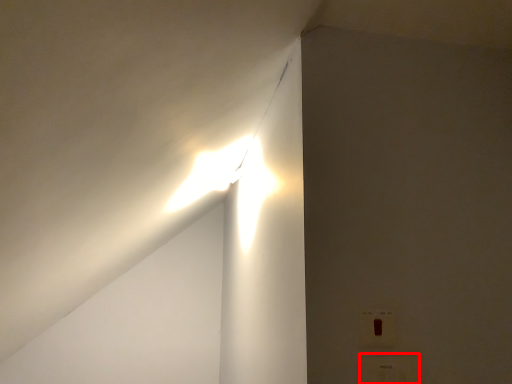
Question: From the image's perspective, what is the correct spatial positioning of electric outlet (annotated by the red box) in reference to electric outlet?

Choices:
 (A) below
 (B) above

Answer: (A)